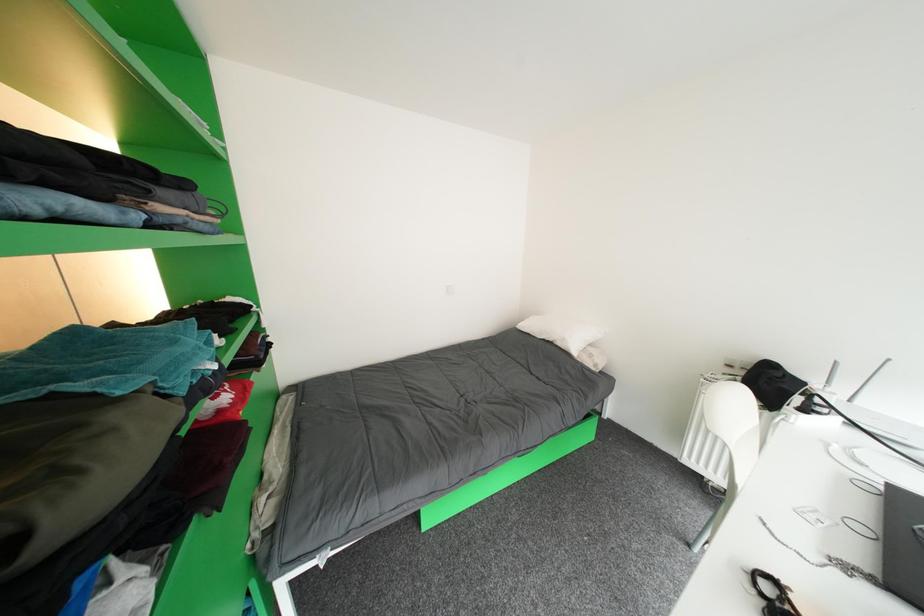
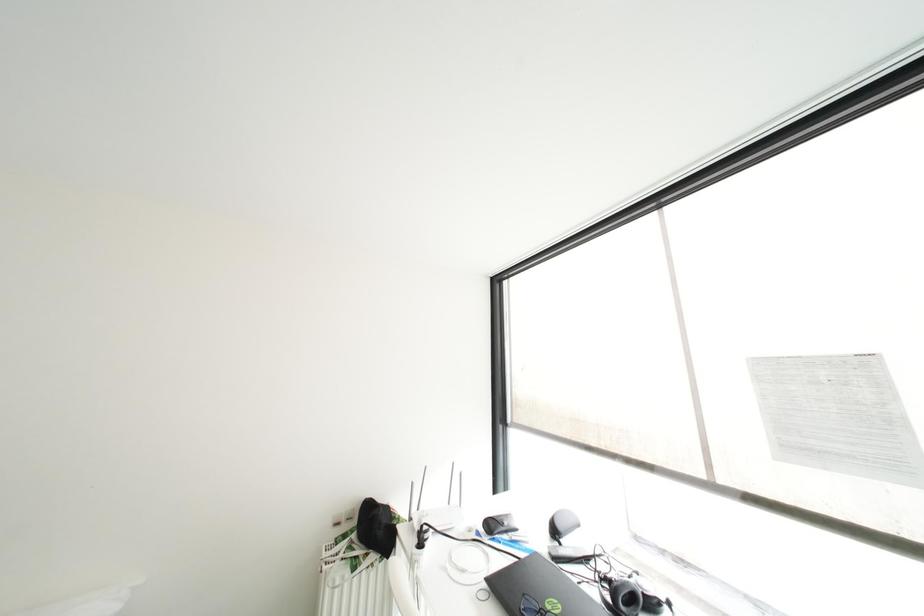
Question: The images are taken continuously from a first-person perspective. In which direction is your viewpoint rotating?

Choices:
 (A) Left
 (B) Right
 (C) Up
 (D) Down

Answer: (B)